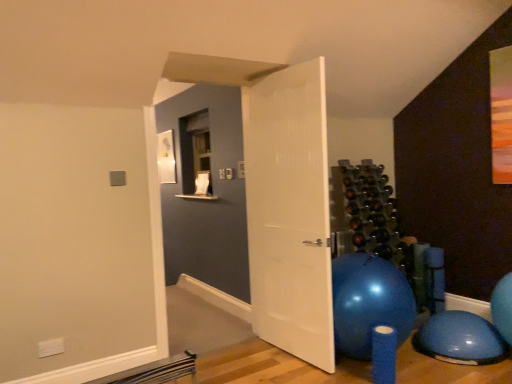
Question: Is white textured door at center shorter than blue rubber ball at lower right?

Choices:
 (A) no
 (B) yes

Answer: (A)

Question: Considering the relative sizes of white textured door at center and blue rubber ball at lower right in the image provided, is white textured door at center smaller than blue rubber ball at lower right?

Choices:
 (A) yes
 (B) no

Answer: (B)

Question: Could you tell me if white textured door at center is turned towards blue rubber ball at lower right?

Choices:
 (A) no
 (B) yes

Answer: (A)

Question: Can you confirm if white textured door at center is bigger than blue rubber ball at lower right?

Choices:
 (A) no
 (B) yes

Answer: (B)

Question: Would you say white textured door at center contains blue rubber ball at lower right?

Choices:
 (A) yes
 (B) no

Answer: (B)

Question: Does white textured door at center come in front of blue rubber ball at lower right?

Choices:
 (A) no
 (B) yes

Answer: (B)

Question: Does blue rubber ball at lower right have a lesser height compared to white textured door at center?

Choices:
 (A) yes
 (B) no

Answer: (A)

Question: From the image's perspective, does blue rubber ball at lower right appear lower than white textured door at center?

Choices:
 (A) yes
 (B) no

Answer: (A)

Question: Is blue rubber ball at lower right far from white textured door at center?

Choices:
 (A) yes
 (B) no

Answer: (A)

Question: From the image's perspective, is blue rubber ball at lower right on white textured door at center?

Choices:
 (A) yes
 (B) no

Answer: (B)

Question: Is blue rubber ball at lower right wider than white textured door at center?

Choices:
 (A) yes
 (B) no

Answer: (A)

Question: Is blue rubber ball at lower right not within white textured door at center?

Choices:
 (A) no
 (B) yes

Answer: (B)

Question: Considering the positions of point (454, 362) and point (280, 213), is point (454, 362) closer or farther from the camera than point (280, 213)?

Choices:
 (A) closer
 (B) farther

Answer: (A)